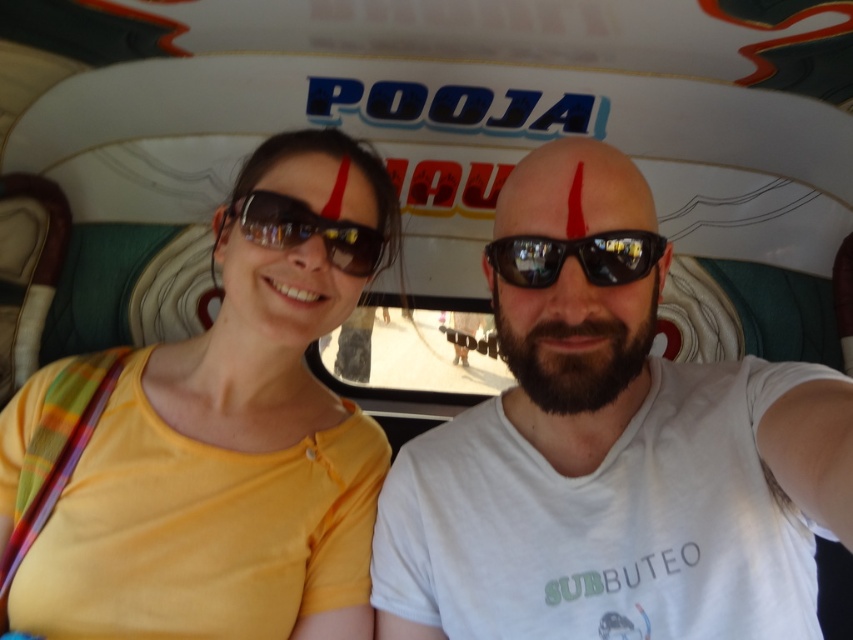
From the picture: You are a passenger in a vehicle and need to locate your eyewear. You remember placing them somewhere in the center area. Which item is positioned lower between the black matte sunglasses at center and the matte black goggles at center?

The black matte sunglasses at center is positioned lower than the matte black goggles at center.

You are inside a vehicle and want to place a small item on the closest point between point (531, 198) and point (305, 204). Which point should you choose?

Point (531, 198) is closer to the viewer than point (305, 204), so you should choose point (531, 198).